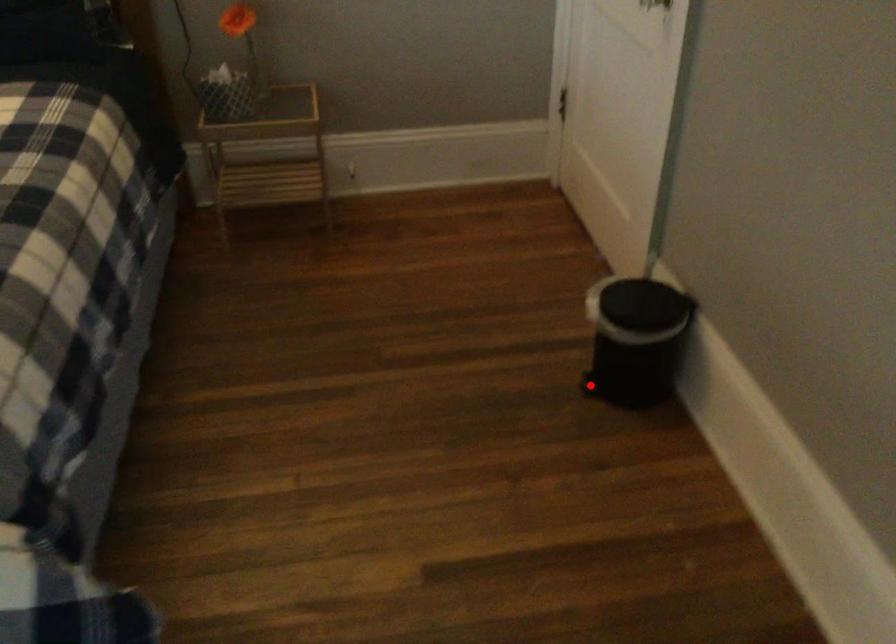
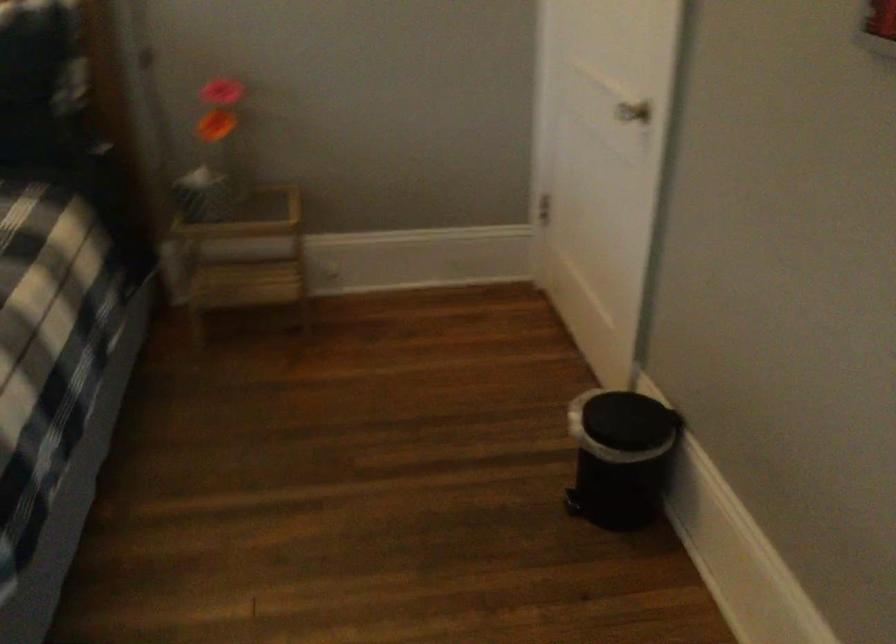
In the second image, find the point that corresponds to the highlighted location in the first image.

(573, 504)